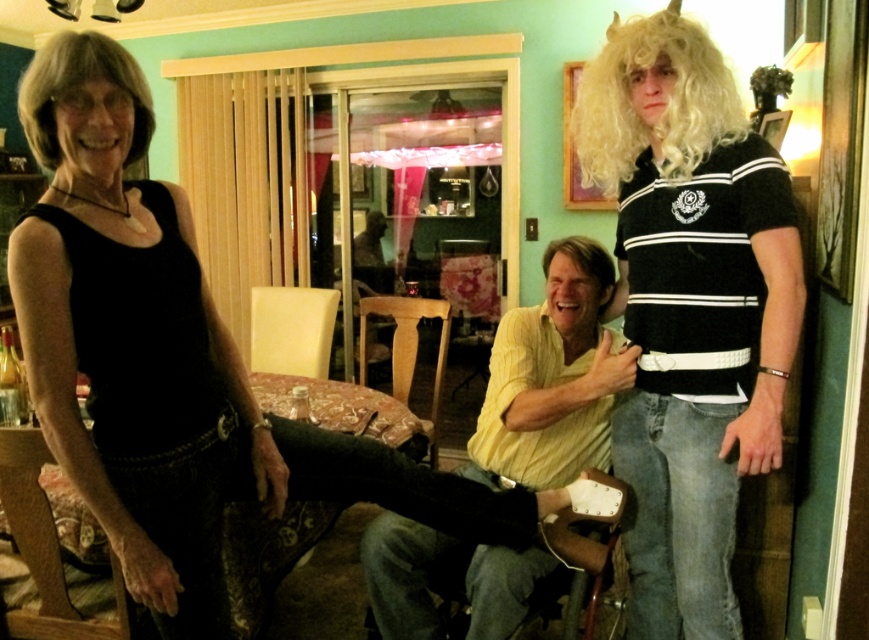
You are a delivery person who needs to place a large package on the floor near the wooden chair at center without disturbing the blonde synthetic wig at center. Can you fit the package between them if the package is 1.2 meters wide?

The wooden chair at center is larger in size than the blonde synthetic wig at center. Since the package is 1.2 meters wide, it might not fit between them if the distance between the wooden chair at center and the blonde synthetic wig at center is less than 1.2 meters. However, the exact spatial relationship isn

You are a photographer setting up for a photoshoot in the living room. You need to ensure that the black matte tank top at left is visible in the frame without being blocked by the blonde synthetic wig at upper right. Based on their positions, can you confirm if this is possible?

The black matte tank top at left is below the blonde synthetic wig at upper right, so it is possible to position the camera angle lower to ensure the tank top remains visible while avoiding obstruction from the wig.

From the picture: You are a photographer setting up for a group photo. You notice the black matte tank top at left and the blonde synthetic wig at upper right. Which object is located to the left of the other?

The black matte tank top at left is positioned on the left side of blonde synthetic wig at upper right.